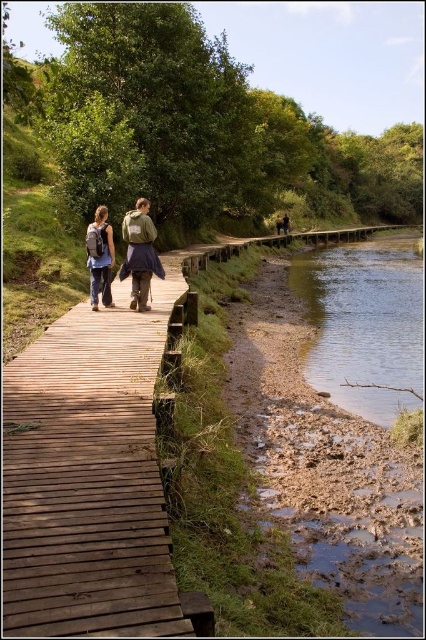
Question: Is brown wooden boardwalk at center to the right of matte black backpack at left from the viewer's perspective?

Choices:
 (A) no
 (B) yes

Answer: (B)

Question: Which point appears closest to the camera in this image?

Choices:
 (A) (314, 289)
 (B) (89, 237)
 (C) (54, 422)

Answer: (C)

Question: Where is brown wooden boardwalk at center located in relation to matte black backpack at left in the image?

Choices:
 (A) below
 (B) above

Answer: (A)

Question: Among these objects, which one is nearest to the camera?

Choices:
 (A) matte black backpack at left
 (B) brown wooden boardwalk at center

Answer: (B)

Question: Does brown wooden boardwalk at center appear on the left side of clear water at lower right?

Choices:
 (A) yes
 (B) no

Answer: (A)

Question: Among these objects, which one is nearest to the camera?

Choices:
 (A) matte brown backpack at center
 (B) brown leather backpack at center
 (C) matte black backpack at left
 (D) clear water at lower right

Answer: (D)